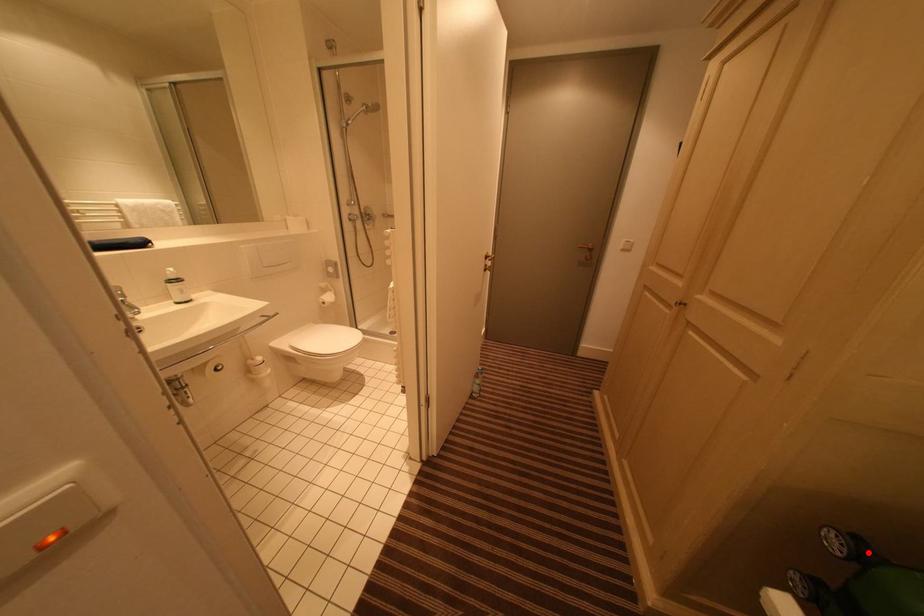
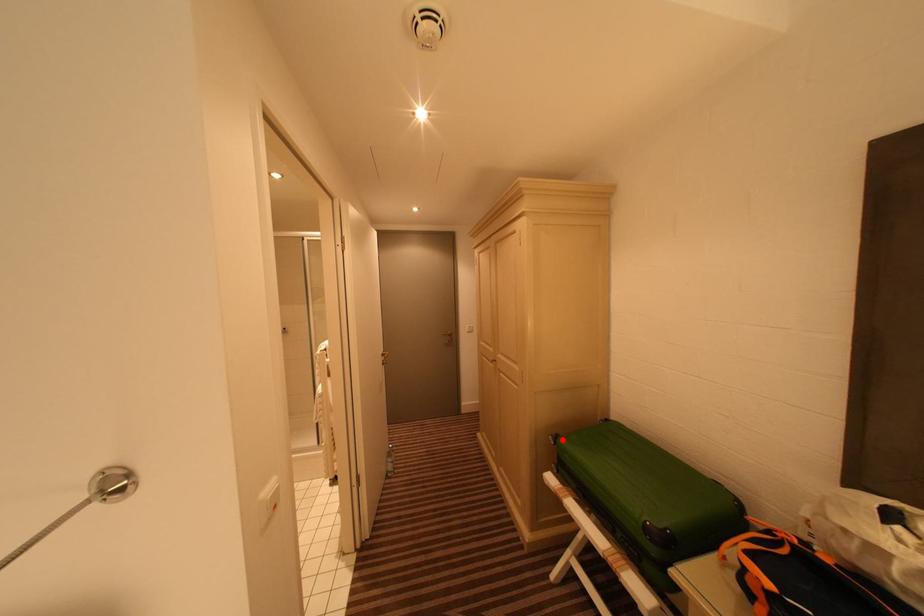
I am providing you with two images of the same scene from different viewpoints. A red point is marked on the first image and another point is marked on the second image. Are the points marked in image1 and image2 representing the same 3D position?

Yes